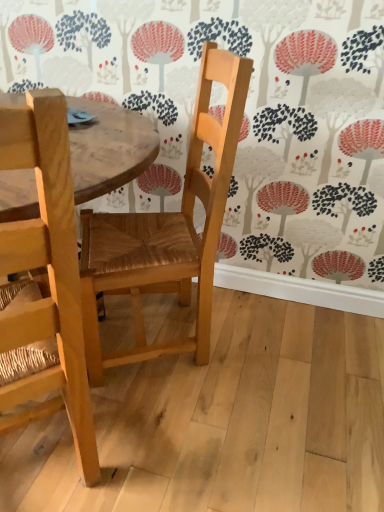
What do you see at coordinates (47, 273) in the screenshot?
I see `natural wood chair at center, which is counted as the second chair, starting from the right` at bounding box center [47, 273].

Identify the location of natural wood chair at center, the 1th chair in the left-to-right sequence. (47, 273).

Identify the location of natural wood chair at center, the first chair from the right. (167, 230).

What do you see at coordinates (167, 230) in the screenshot? I see `natural wood chair at center, the first chair from the right` at bounding box center [167, 230].

The height and width of the screenshot is (512, 384). Find the location of `natural wood chair at center, the 1th chair in the left-to-right sequence`. natural wood chair at center, the 1th chair in the left-to-right sequence is located at coordinates (47, 273).

Which object is positioned more to the right, natural wood chair at center, which is counted as the second chair, starting from the right, or natural wood chair at center, the first chair from the right?

natural wood chair at center, the first chair from the right.

Which object is more forward, natural wood chair at center, which is counted as the second chair, starting from the right, or natural wood chair at center, the second chair positioned from the left?

natural wood chair at center, which is counted as the second chair, starting from the right.

Looking at this image, which is less distant, (60,250) or (128,278)?

The point (60,250) is in front.

From the image's perspective, is natural wood chair at center, the 1th chair in the left-to-right sequence, positioned above or below natural wood chair at center, the second chair positioned from the left?

Clearly, from the image's perspective, natural wood chair at center, the 1th chair in the left-to-right sequence, is below natural wood chair at center, the second chair positioned from the left.

From a real-world perspective, is natural wood chair at center, the 1th chair in the left-to-right sequence, located higher than natural wood chair at center, the first chair from the right?

No, from a real-world perspective, natural wood chair at center, the 1th chair in the left-to-right sequence, is not on top of natural wood chair at center, the first chair from the right.

From the picture: Considering the sizes of objects natural wood chair at center, the 1th chair in the left-to-right sequence, and natural wood chair at center, the first chair from the right, in the image provided, who is thinner, natural wood chair at center, the 1th chair in the left-to-right sequence, or natural wood chair at center, the first chair from the right,?

Thinner between the two is natural wood chair at center, the first chair from the right.

Considering the relative sizes of natural wood chair at center, which is counted as the second chair, starting from the right, and natural wood chair at center, the first chair from the right, in the image provided, is natural wood chair at center, which is counted as the second chair, starting from the right, taller than natural wood chair at center, the first chair from the right,?

Correct, natural wood chair at center, which is counted as the second chair, starting from the right, is much taller as natural wood chair at center, the first chair from the right.

Between natural wood chair at center, the 1th chair in the left-to-right sequence, and natural wood chair at center, the second chair positioned from the left, which one has smaller size?

Smaller between the two is natural wood chair at center, the 1th chair in the left-to-right sequence.

Is natural wood chair at center, the first chair from the right, a part of natural wood chair at center, which is counted as the second chair, starting from the right?

No, natural wood chair at center, the first chair from the right, is not inside natural wood chair at center, which is counted as the second chair, starting from the right.

Is there a large distance between natural wood chair at center, which is counted as the second chair, starting from the right, and natural wood chair at center, the first chair from the right?

No.

Is natural wood chair at center, the 1th chair in the left-to-right sequence, turned away from natural wood chair at center, the first chair from the right?

No.

What's the angular difference between natural wood chair at center, which is counted as the second chair, starting from the right, and natural wood chair at center, the first chair from the right,'s facing directions?

There is a 71.3-degree angle between the facing directions of natural wood chair at center, which is counted as the second chair, starting from the right, and natural wood chair at center, the first chair from the right.

Locate an element on the screen. chair lying below the natural wood chair at center, the second chair positioned from the left (from the image's perspective) is located at coordinates (47, 273).

Between natural wood chair at center, the second chair positioned from the left, and natural wood chair at center, which is counted as the second chair, starting from the right, which one appears on the right side from the viewer's perspective?

natural wood chair at center, the second chair positioned from the left.

Which object is more forward, natural wood chair at center, the first chair from the right, or natural wood chair at center, which is counted as the second chair, starting from the right?

natural wood chair at center, which is counted as the second chair, starting from the right, is in front.

Considering the positions of points (201, 362) and (39, 382), is point (201, 362) closer to camera compared to point (39, 382)?

That is False.

From the image's perspective, does natural wood chair at center, the first chair from the right, appear lower than natural wood chair at center, which is counted as the second chair, starting from the right?

No, from the image's perspective, natural wood chair at center, the first chair from the right, is not beneath natural wood chair at center, which is counted as the second chair, starting from the right.

From a real-world perspective, is natural wood chair at center, the first chair from the right, physically below natural wood chair at center, the 1th chair in the left-to-right sequence?

No.

Does natural wood chair at center, the first chair from the right, have a lesser width compared to natural wood chair at center, which is counted as the second chair, starting from the right?

Yes.

Which of these two, natural wood chair at center, the second chair positioned from the left, or natural wood chair at center, the 1th chair in the left-to-right sequence, stands shorter?

natural wood chair at center, the second chair positioned from the left, is shorter.

Can you confirm if natural wood chair at center, the second chair positioned from the left, is smaller than natural wood chair at center, which is counted as the second chair, starting from the right?

Actually, natural wood chair at center, the second chair positioned from the left, might be larger than natural wood chair at center, which is counted as the second chair, starting from the right.

Is natural wood chair at center, the 1th chair in the left-to-right sequence, inside natural wood chair at center, the first chair from the right?

That's incorrect, natural wood chair at center, the 1th chair in the left-to-right sequence, is not inside natural wood chair at center, the first chair from the right.

Is natural wood chair at center, the first chair from the right, next to natural wood chair at center, which is counted as the second chair, starting from the right, and touching it?

natural wood chair at center, the first chair from the right, and natural wood chair at center, which is counted as the second chair, starting from the right, are not in contact.

Is natural wood chair at center, the second chair positioned from the left, aimed at natural wood chair at center, which is counted as the second chair, starting from the right?

No.

How many degrees apart are the facing directions of natural wood chair at center, the second chair positioned from the left, and natural wood chair at center, which is counted as the second chair, starting from the right?

The angular difference between natural wood chair at center, the second chair positioned from the left, and natural wood chair at center, which is counted as the second chair, starting from the right, is 71.3 degrees.

How far apart are natural wood chair at center, the second chair positioned from the left, and natural wood chair at center, which is counted as the second chair, starting from the right?

natural wood chair at center, the second chair positioned from the left, and natural wood chair at center, which is counted as the second chair, starting from the right, are 18.34 inches apart.

I want to click on chair directly beneath the natural wood chair at center, the second chair positioned from the left (from a real-world perspective), so click(47, 273).

Find the location of a particular element. The width and height of the screenshot is (384, 512). chair below the natural wood chair at center, the first chair from the right (from the image's perspective) is located at coordinates (47, 273).

The width and height of the screenshot is (384, 512). I want to click on chair below the natural wood chair at center, the second chair positioned from the left (from a real-world perspective), so click(x=47, y=273).